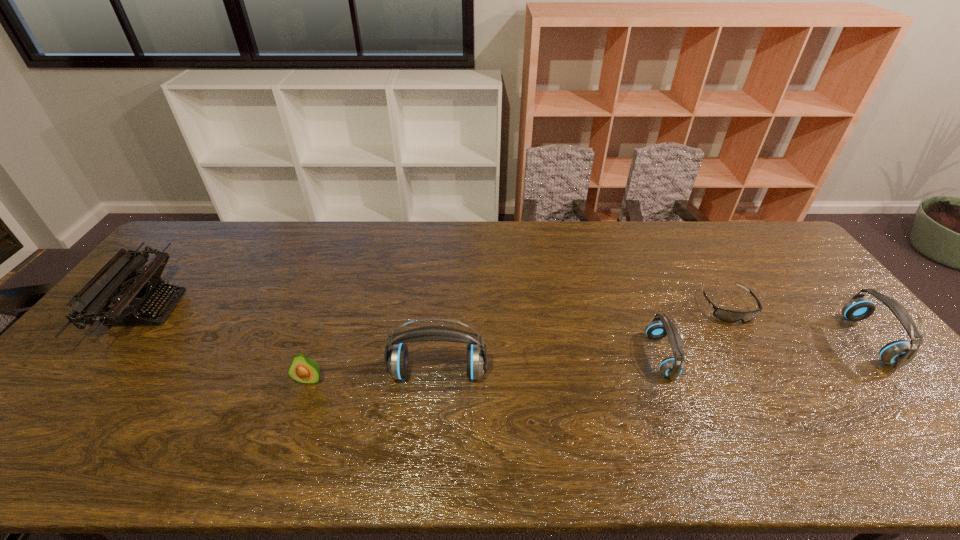
Locate an element on the screen. blank space that satisfies the following two spatial constraints: 1. on the ear cups of the rightmost headset; 2. on the cut side of the avocado is located at coordinates (903, 380).

Identify the location of vacant space that satisfies the following two spatial constraints: 1. on the ear cups of the shortest headset; 2. on the cut side of the second object from left to right. The width and height of the screenshot is (960, 540). (670, 380).

Where is `free spot that satisfies the following two spatial constraints: 1. on the lenses of the second object from right to left; 2. on the typing side of the typewriter`? free spot that satisfies the following two spatial constraints: 1. on the lenses of the second object from right to left; 2. on the typing side of the typewriter is located at coordinates (729, 309).

This screenshot has width=960, height=540. Find the location of `free location that satisfies the following two spatial constraints: 1. on the ear cups of the second tallest headset; 2. on the cut side of the second object from left to right`. free location that satisfies the following two spatial constraints: 1. on the ear cups of the second tallest headset; 2. on the cut side of the second object from left to right is located at coordinates (903, 380).